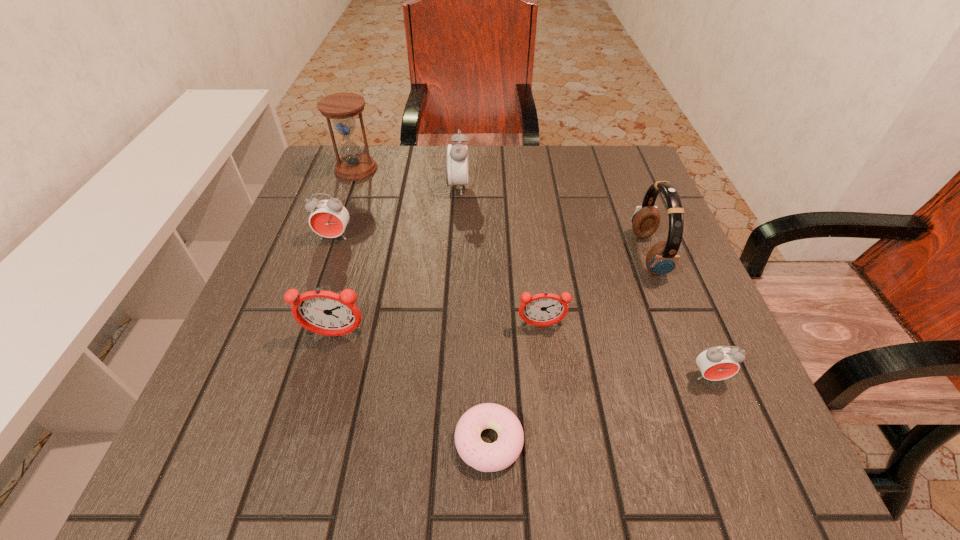
Where is `free location at the far edge`? The height and width of the screenshot is (540, 960). free location at the far edge is located at coordinates (560, 152).

Where is `vacant space at the near edge`? This screenshot has width=960, height=540. vacant space at the near edge is located at coordinates (552, 488).

In order to click on free space at the left edge in this screenshot , I will do `click(364, 214)`.

This screenshot has width=960, height=540. In the image, there is a desktop. What are the coordinates of `blank space at the right edge` in the screenshot? It's located at (647, 284).

The image size is (960, 540). I want to click on free space at the far left corner, so (x=337, y=180).

Image resolution: width=960 pixels, height=540 pixels. In order to click on vacant space at the near left corner of the desktop in this screenshot , I will do `click(283, 430)`.

What are the coordinates of `vacant region at the far right corner of the desktop` in the screenshot? It's located at (623, 178).

Locate an element on the screen. This screenshot has width=960, height=540. free space between the brown headset and the doughnut is located at coordinates (568, 348).

The image size is (960, 540). In order to click on free space between the leftmost red alarm clock and the hourglass in this screenshot , I will do `click(346, 203)`.

This screenshot has height=540, width=960. Find the location of `free space between the nearest alarm clock and the headset`. free space between the nearest alarm clock and the headset is located at coordinates (679, 315).